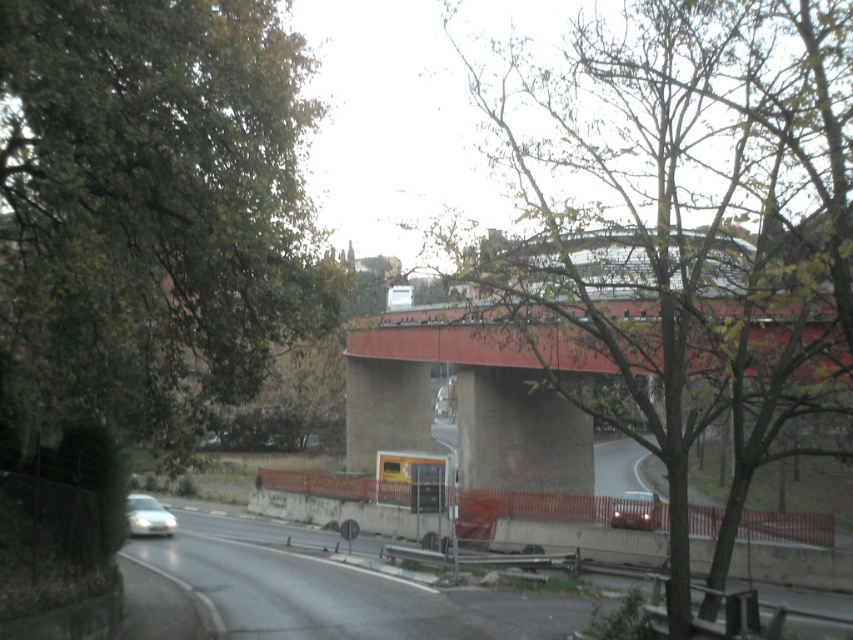
Question: Does green leafy tree at center have a greater width compared to gray concrete highway at lower left?

Choices:
 (A) yes
 (B) no

Answer: (B)

Question: Which object is closer to the camera taking this photo?

Choices:
 (A) gray concrete highway at lower left
 (B) green leafy tree at left
 (C) green leafy tree at center
 (D) shiny silver car at center

Answer: (B)

Question: Can you confirm if green leafy tree at left is positioned to the right of gray concrete highway at lower left?

Choices:
 (A) yes
 (B) no

Answer: (B)

Question: Can you confirm if green leafy tree at left is positioned to the left of green leafy tree at center?

Choices:
 (A) no
 (B) yes

Answer: (B)

Question: Which object is the closest to the green leafy tree at center?

Choices:
 (A) shiny silver car at center
 (B) gray concrete highway at lower left
 (C) silver metallic car at lower left
 (D) green leafy tree at left

Answer: (D)

Question: Which of the following is the closest to the observer?

Choices:
 (A) (184, 531)
 (B) (131, 20)

Answer: (B)